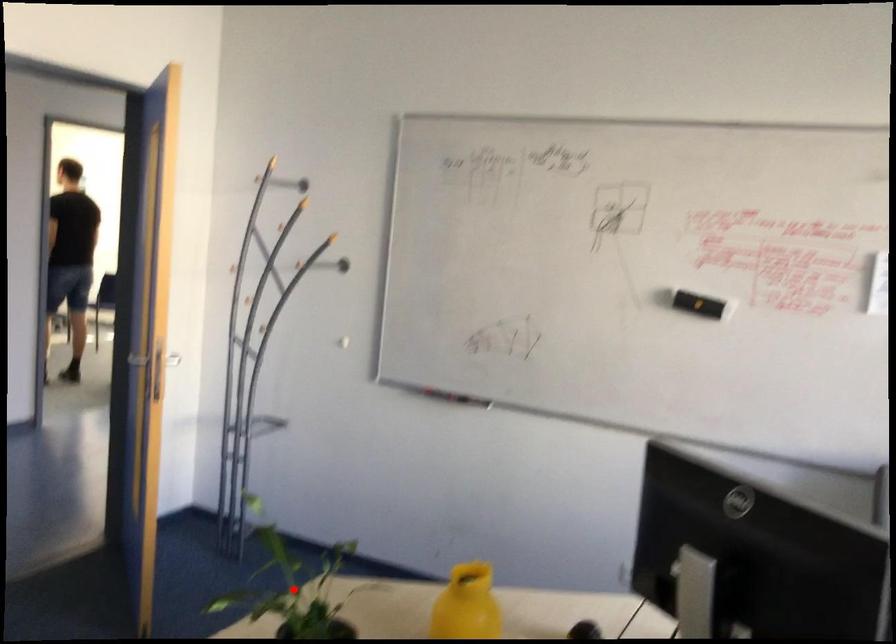
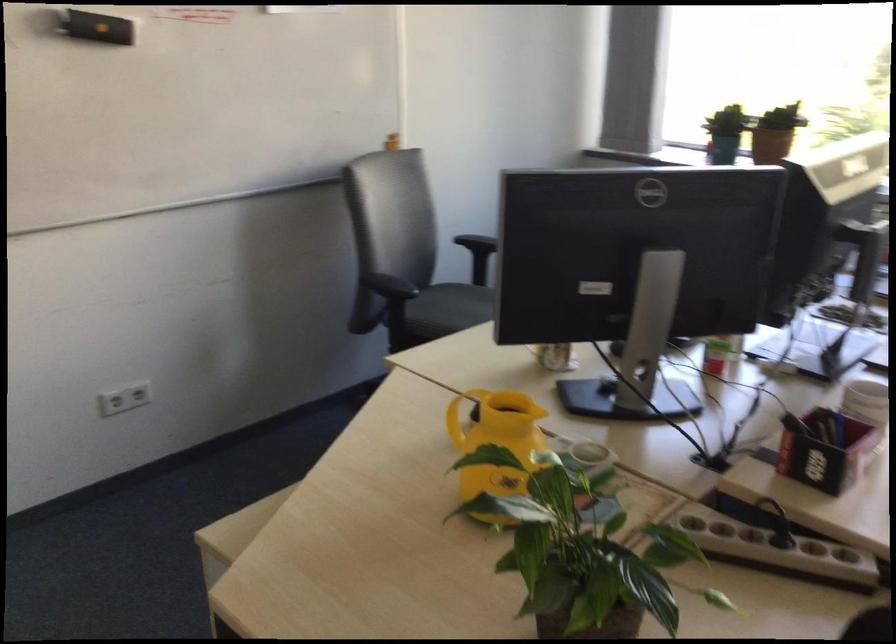
Question: I am providing you with two images of the same scene from different viewpoints. A red point is marked on the first image. At the location where the point appears in image 1, is it still visible in image 2?

Choices:
 (A) Yes
 (B) No

Answer: (B)